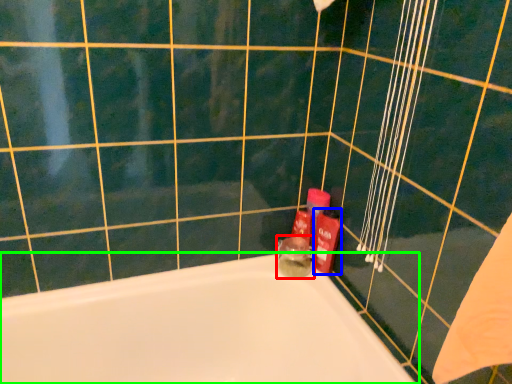
Question: Which object is the farthest from toiletry (highlighted by a red box)? Choose among these: toiletry (highlighted by a blue box) or bathtub (highlighted by a green box).

Choices:
 (A) toiletry
 (B) bathtub

Answer: (B)